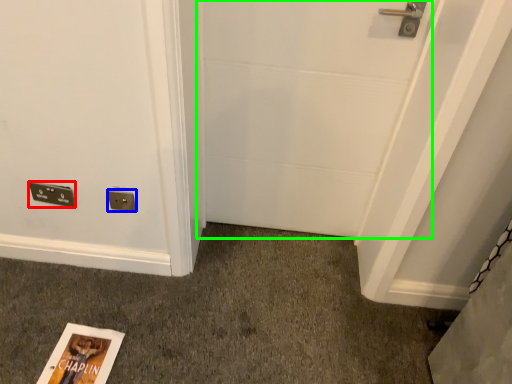
Question: Which is farther away from light switch (highlighted by a red box)? electric outlet (highlighted by a blue box) or door (highlighted by a green box)?

Choices:
 (A) electric outlet
 (B) door

Answer: (B)